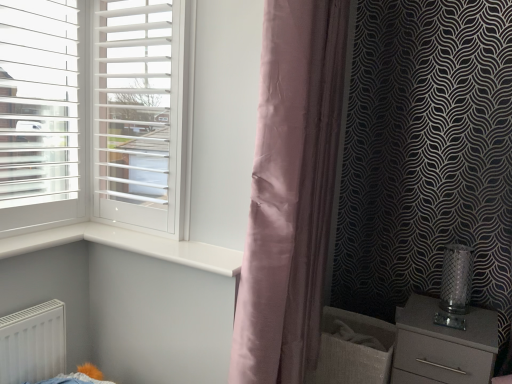
Find the location of a particular element. vacant area that is in front of white matte screen door at left is located at coordinates (135, 244).